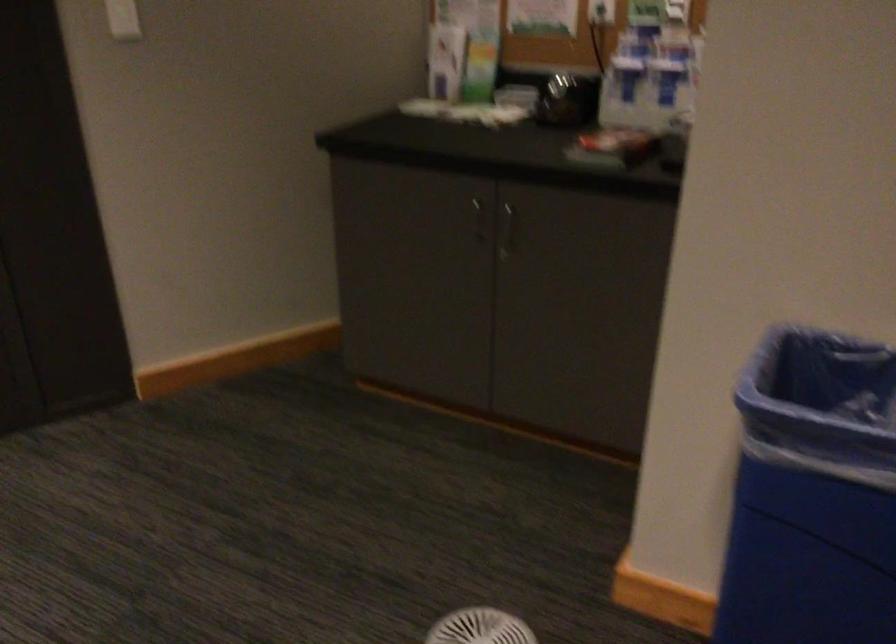
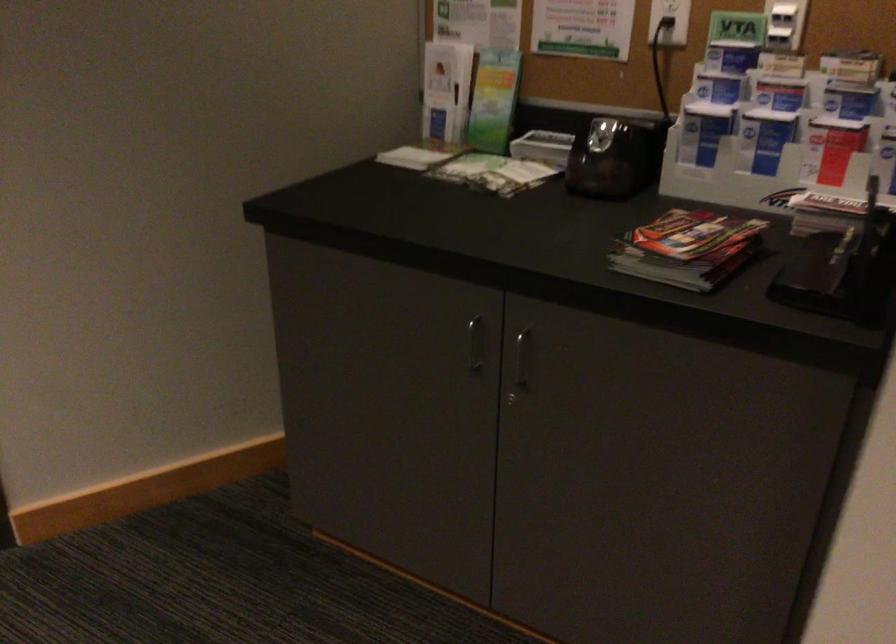
In the second image, find the point that corresponds to point (613, 144) in the first image.

(687, 249)